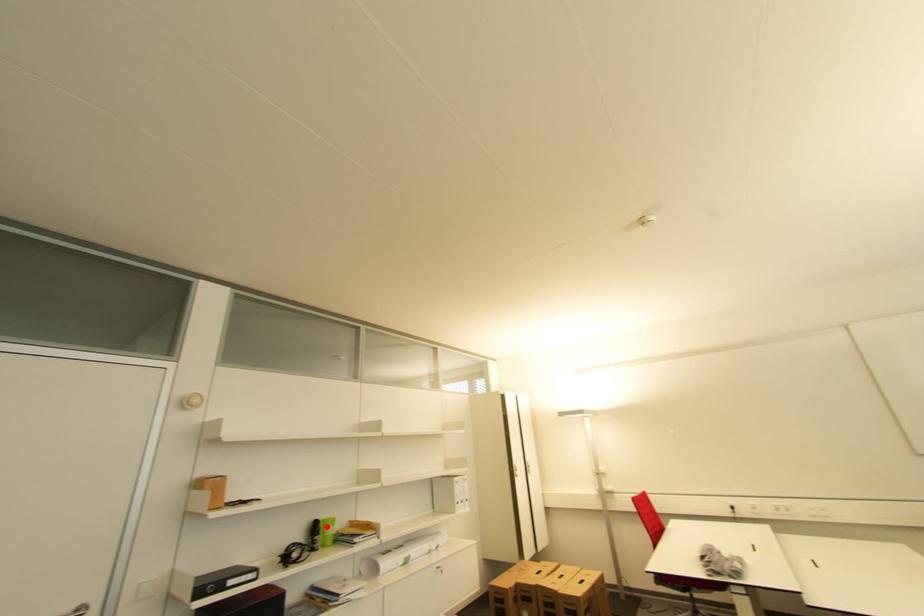
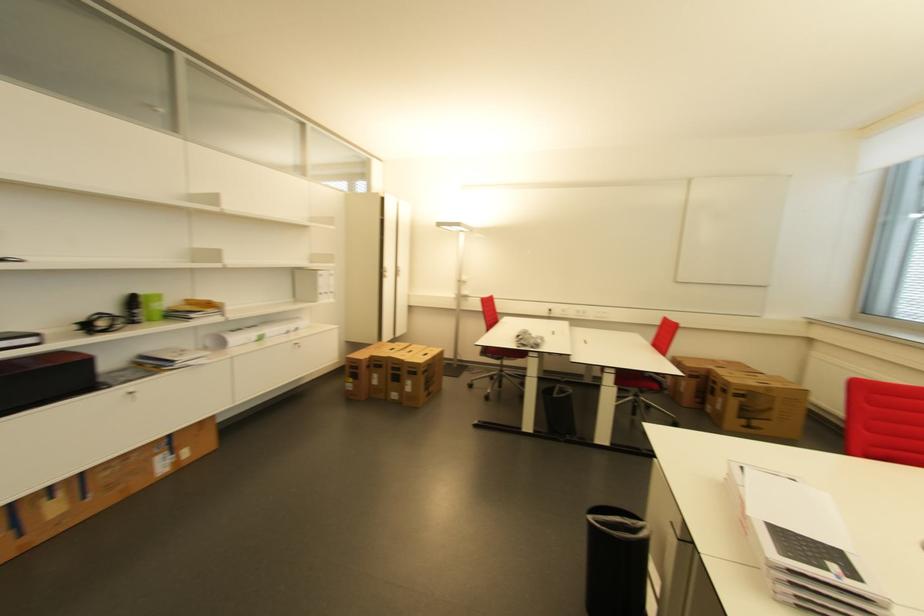
Where in the second image is the point corresponding to the highlighted location from the first image?

(147, 301)